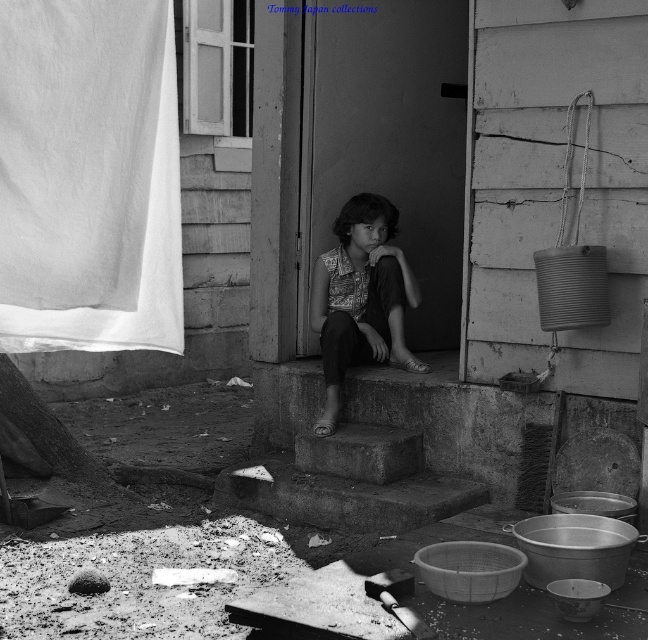
Is white cotton cloth at left shorter than concrete stairs at center?

No, white cotton cloth at left is not shorter than concrete stairs at center.

Is point (1, 156) positioned after point (384, 513)?

No, (1, 156) is closer to viewer.

Who is more forward, (41, 243) or (338, 490)?

Point (41, 243)

Find the location of a particular element. Image resolution: width=648 pixels, height=640 pixels. white cotton cloth at left is located at coordinates (87, 177).

Does concrete stairs at center have a greater height compared to patterned fabric shirt at center?

In fact, concrete stairs at center may be shorter than patterned fabric shirt at center.

Which is below, concrete stairs at center or patterned fabric shirt at center?

concrete stairs at center

Describe the element at coordinates (349, 452) in the screenshot. The image size is (648, 640). I see `concrete stairs at center` at that location.

At what (x,y) coordinates should I click in order to perform the action: click on concrete stairs at center. Please return your answer as a coordinate pair (x, y). The height and width of the screenshot is (640, 648). Looking at the image, I should click on (x=349, y=452).

Who is lower down, white cotton cloth at left or patterned fabric shirt at center?

patterned fabric shirt at center is lower down.

Does white cotton cloth at left appear on the right side of patterned fabric shirt at center?

Incorrect, white cotton cloth at left is not on the right side of patterned fabric shirt at center.

Who is more distant from viewer, (163, 51) or (386, 340)?

The point (386, 340) is behind.

The image size is (648, 640). What are the coordinates of `white cotton cloth at left` in the screenshot? It's located at (87, 177).